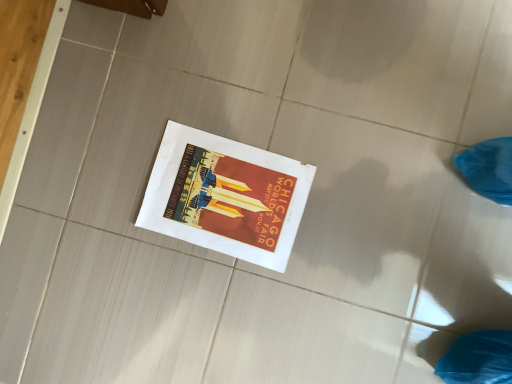
You are a GUI agent. You are given a task and a screenshot of the screen. Output one action in this format:
    pyautogui.click(x=<x>, y=<y>)
    Task: Click on the blank space above white paper poster at center (from a real-world perspective)
    
    Given the screenshot: What is the action you would take?
    pyautogui.click(x=230, y=195)